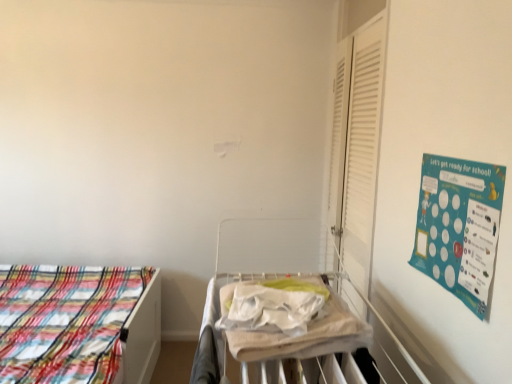
Question: Is point (308, 345) closer or farther from the camera than point (350, 132)?

Choices:
 (A) farther
 (B) closer

Answer: (B)

Question: Considering the positions of white fabric hospital bed at center and white matte shutter at right in the image, is white fabric hospital bed at center bigger or smaller than white matte shutter at right?

Choices:
 (A) big
 (B) small

Answer: (A)

Question: Which is farther from the plaid fabric bed at left?

Choices:
 (A) white fabric hospital bed at center
 (B) white matte shutter at right
 (C) beige cotton blanket at center
 (D) teal paperboard at upper right

Answer: (D)

Question: Which is farther from the plaid fabric bed at left?

Choices:
 (A) white fabric hospital bed at center
 (B) white matte shutter at right
 (C) beige cotton blanket at center
 (D) teal paperboard at upper right

Answer: (D)